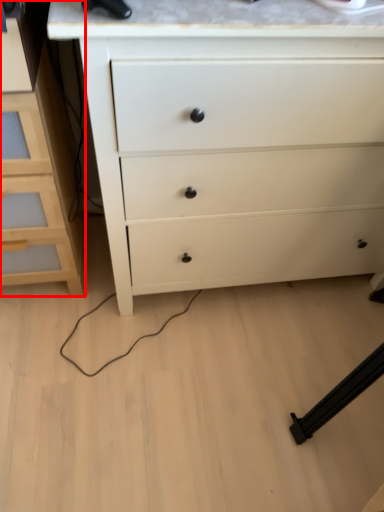
Question: Observing the image, what is the correct spatial positioning of chest of drawers (annotated by the red box) in reference to chest of drawers?

Choices:
 (A) right
 (B) left

Answer: (B)